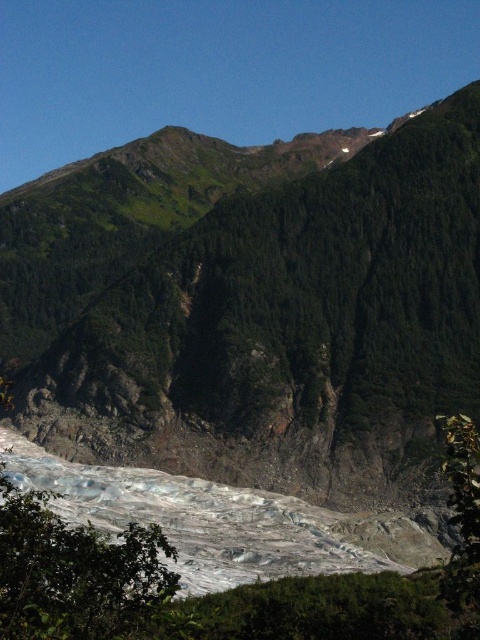
Question: Which point is farther from the camera taking this photo?

Choices:
 (A) (14, 500)
 (B) (59, 333)

Answer: (B)

Question: Which point is farther to the camera?

Choices:
 (A) green rocky mountain at upper center
 (B) green leafy tree at lower left

Answer: (A)

Question: Can you confirm if green rocky mountain at upper center is thinner than green leafy tree at lower left?

Choices:
 (A) yes
 (B) no

Answer: (B)

Question: Does green rocky mountain at upper center appear over green leafy tree at lower left?

Choices:
 (A) yes
 (B) no

Answer: (A)

Question: Can you confirm if green rocky mountain at upper center is positioned to the right of green leafy tree at lower left?

Choices:
 (A) no
 (B) yes

Answer: (B)